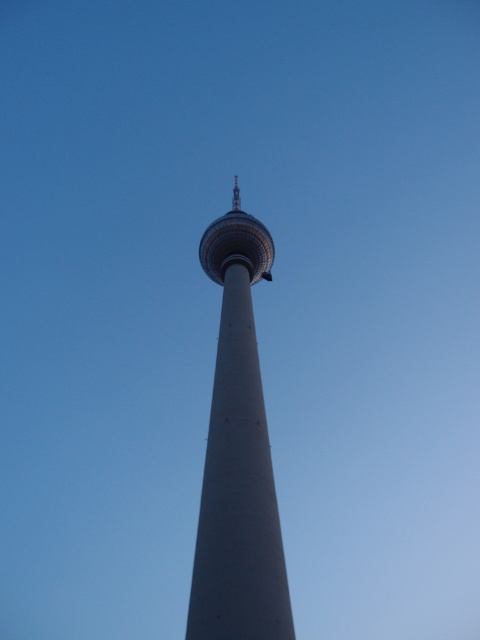
You are standing at the coordinates given in the image description. If you look directly ahead, which direction would the smooth concrete tower at center be relative to your position?

The smooth concrete tower at center is located at coordinates point (238, 458), so if you are standing at the given coordinates and look directly ahead, the tower would be positioned to your right side.

Based on the photo, you are a photographer trying to capture the smooth concrete tower at center and the sleek metallic tower at center in the same frame. Based on their positions, which tower would appear closer to the camera in your photo?

The smooth concrete tower at center appears closer to the camera because it is positioned in front of the sleek metallic tower at center.

You are an engineer assessing the structural integrity of the tower. Given that the smooth concrete tower at center is wider than the sleek metallic tower at center, which one might have a stronger base for supporting heavy equipment on its upper platform?

The smooth concrete tower at center has a wider base than the sleek metallic tower at center, so it likely has a stronger base for supporting heavy equipment on its upper platform.